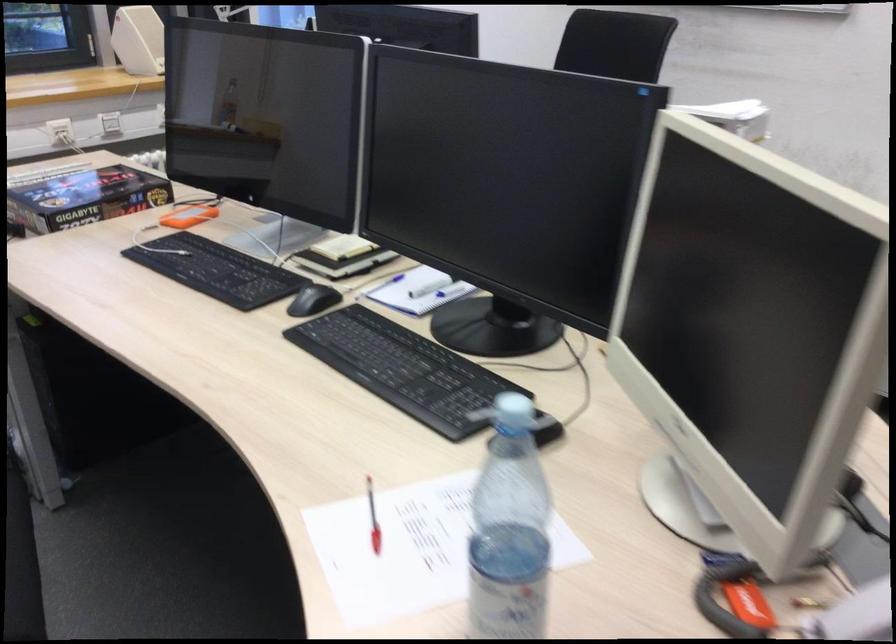
This screenshot has height=644, width=896. I want to click on red and white pen, so click(373, 518).